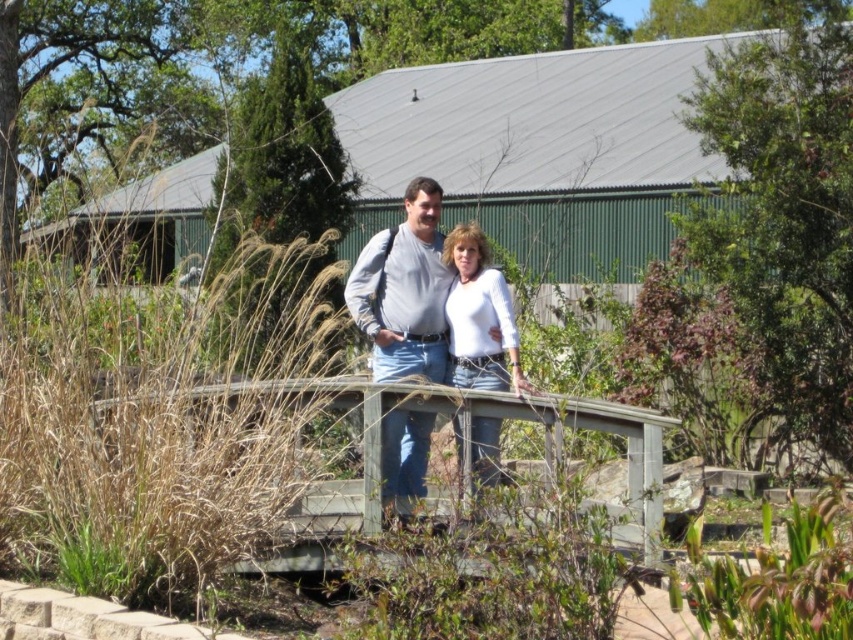
You are a photographer trying to capture a clear photo of both the matte gray shirt at center and the white matte shirt at center. Since you want to focus on the person closer to you, which one should you adjust your camera to focus on?

The matte gray shirt at center is closer to the viewer than the white matte shirt at center, so you should focus on the matte gray shirt at center.